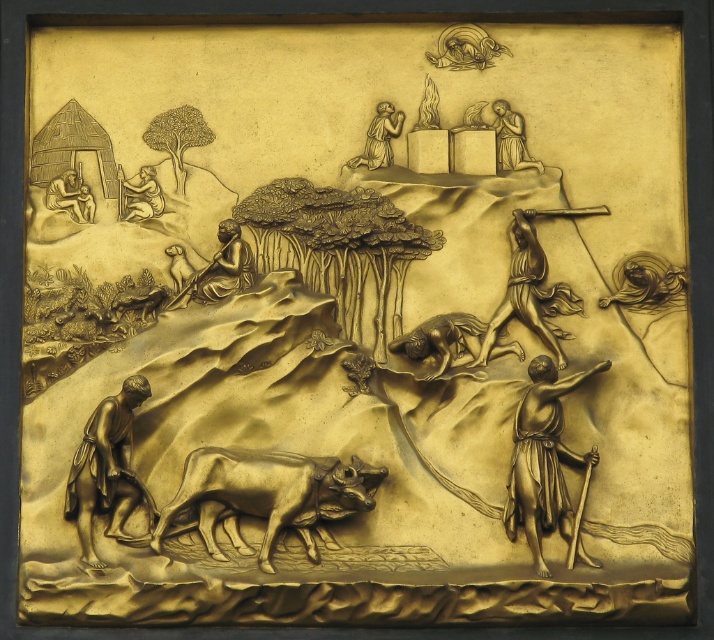
Looking at this image, based on the scene description, can you determine the spatial relationship between the bronze farmer at lower left and the gold textured figure at center?

The bronze farmer at lower left is located below the gold textured figure at center.

Based on the scene description, can you identify the object located at point (106, 468)?

The bronze farmer at lower left is located at point (106, 468).

You are an art conservator examining the bronze relief sculpture. You need to locate the polished bronze shepherd at right for restoration. According to the coordinates provided, where would you find this figure in the image?

The polished bronze shepherd at right is located at the 2D coordinates point (543, 458) in the image.